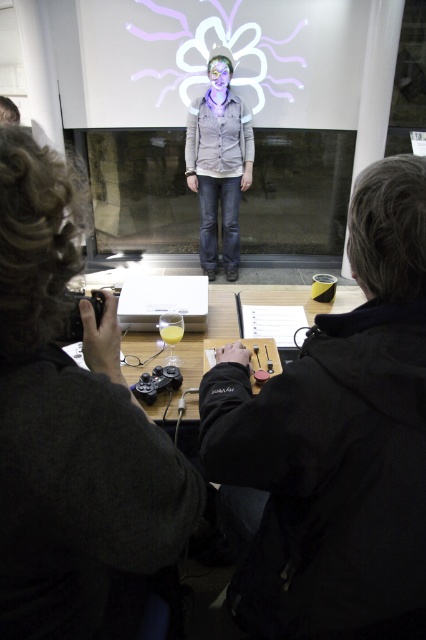
You are organizing a small event and need to place a 60 cm wide banner between the black matte jacket at center and the nearest wall. Is there enough space?

The objects description states that the black matte jacket at center is 62.10 centimeters away from the nearest wall. Since the banner is 60 cm wide, there is enough space to place it between the jacket and the wall.